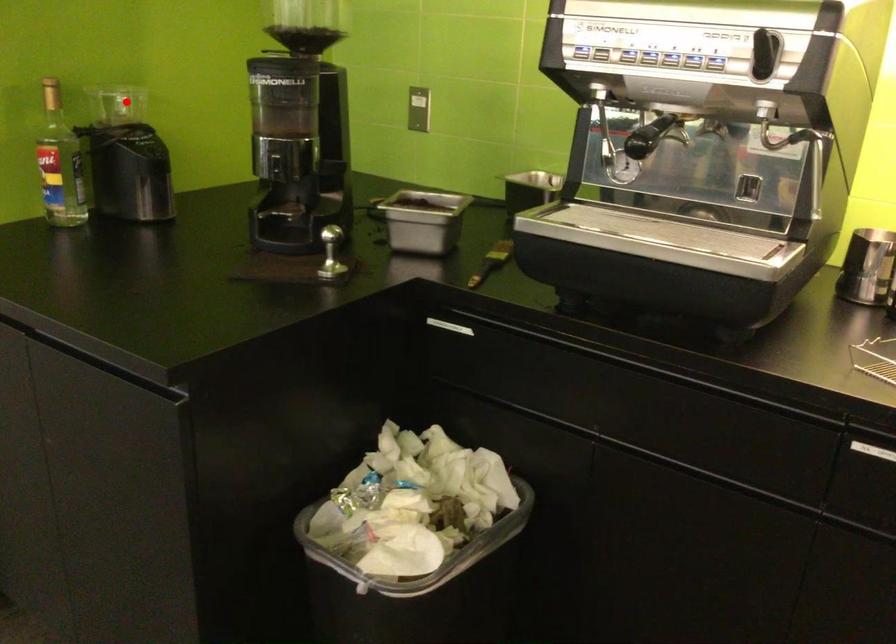
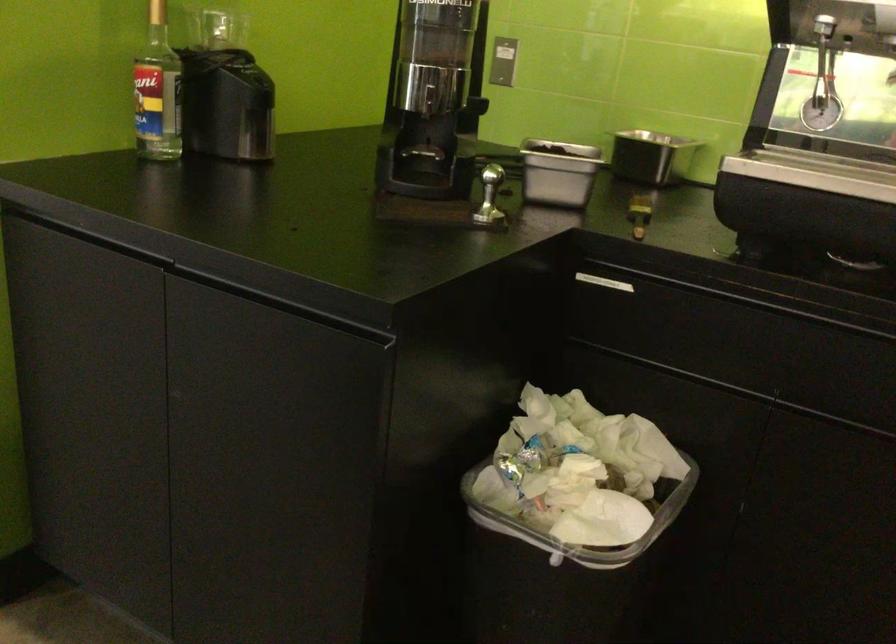
Question: I am providing you with two images of the same scene from different viewpoints. A red point is shown in image1. For the corresponding object point in image2, is it positioned nearer or farther from the camera?

Choices:
 (A) Nearer
 (B) Farther

Answer: (A)